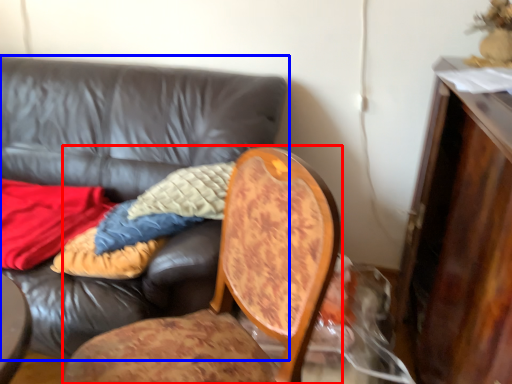
Question: Which object appears farthest to the camera in this image, chair (highlighted by a red box) or studio couch (highlighted by a blue box)?

Choices:
 (A) chair
 (B) studio couch

Answer: (B)